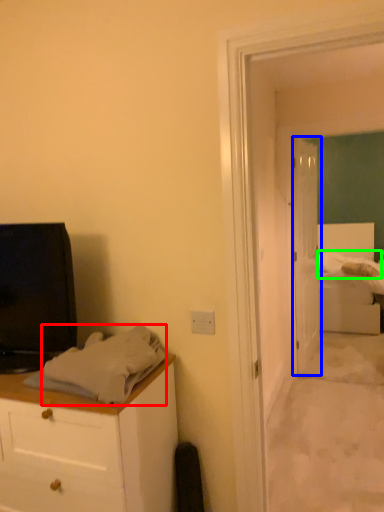
Question: Based on their relative distances, which object is farther from sheet (highlighted by a red box)? Choose from door (highlighted by a blue box) and sheet (highlighted by a green box).

Choices:
 (A) door
 (B) sheet

Answer: (B)